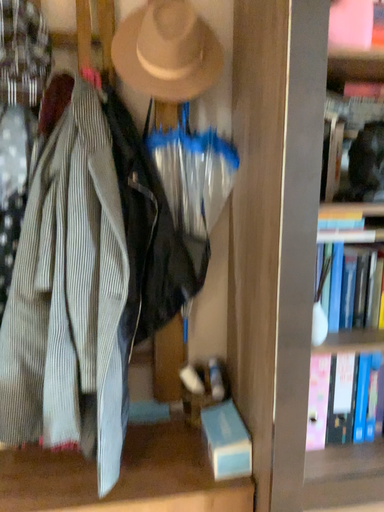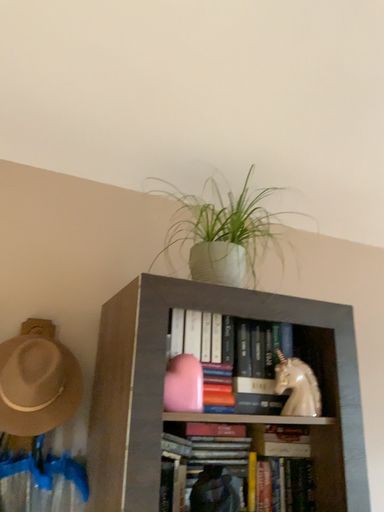
Question: Which way did the camera rotate in the video?

Choices:
 (A) rotated downward
 (B) rotated upward

Answer: (B)